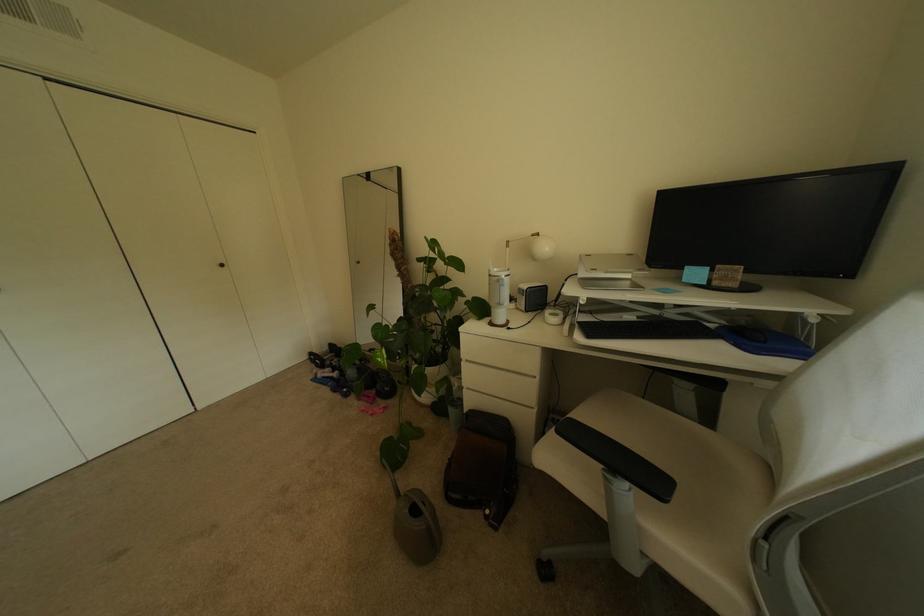
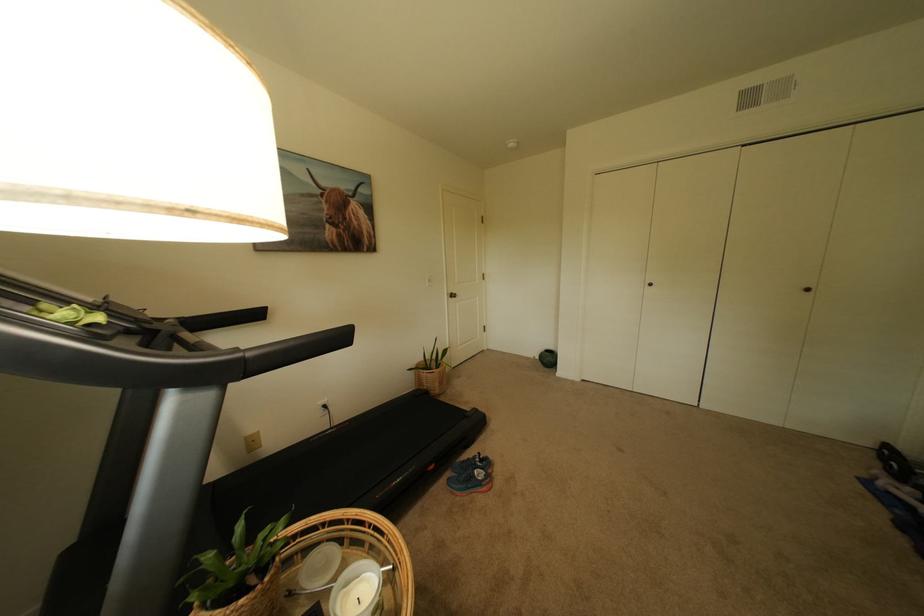
First-person continuous shooting, in which direction is the camera rotating?

The camera rotated toward left-down.